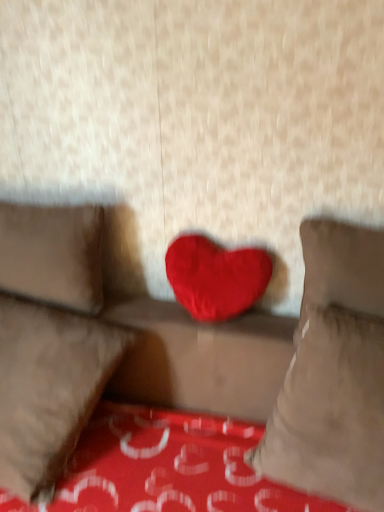
Where is `suede-like beige pillow at left, the first pillow in the left-to-right sequence`? Image resolution: width=384 pixels, height=512 pixels. suede-like beige pillow at left, the first pillow in the left-to-right sequence is located at coordinates (53, 254).

Who is bigger, velvet red heart at center or suede-like beige pillow at left, the first pillow in the left-to-right sequence?

velvet red heart at center is bigger.

Image resolution: width=384 pixels, height=512 pixels. I want to click on studio couch on the right of suede-like beige pillow at left, placed as the third pillow when sorted from right to left, so click(202, 360).

Who is more distant, velvet red heart at center or suede-like beige pillow at left, the first pillow in the left-to-right sequence?

suede-like beige pillow at left, the first pillow in the left-to-right sequence, is more distant.

Choose the correct answer: Is velvet red heart at center inside suede-like beige pillow at left, the first pillow in the left-to-right sequence, or outside it?

velvet red heart at center is not inside suede-like beige pillow at left, the first pillow in the left-to-right sequence, it's outside.

From a real-world perspective, is velvet red heart at center, positioned as the third pillow in left-to-right order, beneath red plush heart at center?

Yes.

Between point (253, 451) and point (210, 242), which one is positioned in front?

The point (253, 451) is closer.

Is velvet red heart at center, positioned as the third pillow in left-to-right order, at the left side of red plush heart at center?

No.

Is velvet red heart at center, positioned as the third pillow in left-to-right order, beside red plush heart at center?

No, velvet red heart at center, positioned as the third pillow in left-to-right order, is not with red plush heart at center.

Considering the sizes of objects velvet red heart at center, which is the 2th pillow from right to left, and velvet red heart at center, positioned as the third pillow in left-to-right order, in the image provided, who is thinner, velvet red heart at center, which is the 2th pillow from right to left, or velvet red heart at center, positioned as the third pillow in left-to-right order,?

With smaller width is velvet red heart at center, positioned as the third pillow in left-to-right order.

In the image, is velvet red heart at center, which is the 2th pillow from right to left, on the left side or the right side of velvet red heart at center, marked as the first pillow in a right-to-left arrangement?

velvet red heart at center, which is the 2th pillow from right to left, is positioned on velvet red heart at center, marked as the first pillow in a right-to-left arrangement,'s left side.

In the scene shown: Is velvet red heart at center, which is the 2th pillow from right to left, located outside velvet red heart at center, marked as the first pillow in a right-to-left arrangement?

That's correct, velvet red heart at center, which is the 2th pillow from right to left, is outside of velvet red heart at center, marked as the first pillow in a right-to-left arrangement.

Is velvet red heart at center, which is the 2th pillow from right to left, looking in the opposite direction of velvet red heart at center, positioned as the third pillow in left-to-right order?

No, velvet red heart at center, which is the 2th pillow from right to left,'s orientation is not away from velvet red heart at center, positioned as the third pillow in left-to-right order.

Is red plush heart at center directly adjacent to velvet red heart at center?

There is a gap between red plush heart at center and velvet red heart at center.

Is red plush heart at center looking in the opposite direction of velvet red heart at center?

That's not correct — red plush heart at center is not looking away from velvet red heart at center.

Considering the sizes of red plush heart at center and velvet red heart at center in the image, is red plush heart at center taller or shorter than velvet red heart at center?

In the image, red plush heart at center appears to be shorter than velvet red heart at center.

Considering the positions of objects red plush heart at center and velvet red heart at center in the image provided, who is behind, red plush heart at center or velvet red heart at center?

red plush heart at center is more distant.

The height and width of the screenshot is (512, 384). Find the location of `studio couch on the left of the velvet red heart at center, marked as the first pillow in a right-to-left arrangement`. studio couch on the left of the velvet red heart at center, marked as the first pillow in a right-to-left arrangement is located at coordinates (202, 360).

Is velvet red heart at center taller or shorter than velvet red heart at center, positioned as the third pillow in left-to-right order?

Clearly, velvet red heart at center is shorter compared to velvet red heart at center, positioned as the third pillow in left-to-right order.

Based on their positions, is velvet red heart at center located to the left or right of velvet red heart at center, positioned as the third pillow in left-to-right order?

Clearly, velvet red heart at center is on the left of velvet red heart at center, positioned as the third pillow in left-to-right order, in the image.

Is velvet red heart at center, which is the 2th pillow from left to right, completely or partially inside velvet red heart at center, positioned as the third pillow in left-to-right order?

Actually, velvet red heart at center, which is the 2th pillow from left to right, is outside velvet red heart at center, positioned as the third pillow in left-to-right order.

Considering the positions of points (313, 333) and (63, 324), is point (313, 333) closer to camera compared to point (63, 324)?

Yes, it is in front of point (63, 324).

Would you consider velvet red heart at center, marked as the first pillow in a right-to-left arrangement, to be distant from velvet red heart at center, which is the 2th pillow from right to left?

Actually, velvet red heart at center, marked as the first pillow in a right-to-left arrangement, and velvet red heart at center, which is the 2th pillow from right to left, are a little close together.

Is velvet red heart at center, positioned as the third pillow in left-to-right order, taller or shorter than velvet red heart at center, which is the 2th pillow from left to right?

velvet red heart at center, positioned as the third pillow in left-to-right order, is shorter than velvet red heart at center, which is the 2th pillow from left to right.

Would you consider red plush heart at center to be distant from velvet red heart at center, which is the 2th pillow from left to right?

No, red plush heart at center is not far away from velvet red heart at center, which is the 2th pillow from left to right.

Based on the photo, is red plush heart at center at the left side of velvet red heart at center, which is the 2th pillow from right to left?

No, red plush heart at center is not to the left of velvet red heart at center, which is the 2th pillow from right to left.

How different are the orientations of red plush heart at center and velvet red heart at center, which is the 2th pillow from right to left, in degrees?

2.86 degrees.

From a real-world perspective, between red plush heart at center and velvet red heart at center, which is the 2th pillow from right to left, who is vertically lower?

velvet red heart at center, which is the 2th pillow from right to left.

Find the location of a particular element. The image size is (384, 512). studio couch that appears on the right of suede-like beige pillow at left, the first pillow in the left-to-right sequence is located at coordinates (202, 360).

Locate an element on the screen. The height and width of the screenshot is (512, 384). heart located above the velvet red heart at center, marked as the first pillow in a right-to-left arrangement (from a real-world perspective) is located at coordinates (216, 277).

Which object lies nearer to the anchor point velvet red heart at center, positioned as the third pillow in left-to-right order, suede-like beige pillow at left, placed as the third pillow when sorted from right to left, or velvet red heart at center?

velvet red heart at center is closer to velvet red heart at center, positioned as the third pillow in left-to-right order.

Considering their positions, is velvet red heart at center, which is the 2th pillow from right to left, positioned closer to suede-like beige pillow at left, the first pillow in the left-to-right sequence, than red plush heart at center?

The object closer to suede-like beige pillow at left, the first pillow in the left-to-right sequence, is velvet red heart at center, which is the 2th pillow from right to left.

Looking at the image, which one is located further to red plush heart at center, suede-like beige pillow at left, the first pillow in the left-to-right sequence, or velvet red heart at center, marked as the first pillow in a right-to-left arrangement?

velvet red heart at center, marked as the first pillow in a right-to-left arrangement, is positioned further to the anchor red plush heart at center.

Looking at the image, which one is located further to velvet red heart at center, suede-like beige pillow at left, placed as the third pillow when sorted from right to left, or velvet red heart at center, marked as the first pillow in a right-to-left arrangement?

velvet red heart at center, marked as the first pillow in a right-to-left arrangement.

Considering their positions, is velvet red heart at center, which is the 2th pillow from right to left, positioned further to red plush heart at center than velvet red heart at center, positioned as the third pillow in left-to-right order?

Based on the image, velvet red heart at center, which is the 2th pillow from right to left, appears to be further to red plush heart at center.

Considering their positions, is velvet red heart at center, which is the 2th pillow from left to right, positioned further to velvet red heart at center than red plush heart at center?

Among the two, red plush heart at center is located further to velvet red heart at center.

Looking at this image, from the image, which object appears to be farther from velvet red heart at center, velvet red heart at center, marked as the first pillow in a right-to-left arrangement, or velvet red heart at center, which is the 2th pillow from left to right?

velvet red heart at center, marked as the first pillow in a right-to-left arrangement, is further to velvet red heart at center.

Based on their spatial positions, is suede-like beige pillow at left, placed as the third pillow when sorted from right to left, or red plush heart at center further from velvet red heart at center, marked as the first pillow in a right-to-left arrangement?

Based on the image, suede-like beige pillow at left, placed as the third pillow when sorted from right to left, appears to be further to velvet red heart at center, marked as the first pillow in a right-to-left arrangement.

Where is `pillow between suede-like beige pillow at left, the first pillow in the left-to-right sequence, and velvet red heart at center, marked as the first pillow in a right-to-left arrangement, in the horizontal direction`? pillow between suede-like beige pillow at left, the first pillow in the left-to-right sequence, and velvet red heart at center, marked as the first pillow in a right-to-left arrangement, in the horizontal direction is located at coordinates (48, 388).

Locate an element on the screen. The width and height of the screenshot is (384, 512). heart between velvet red heart at center, which is the 2th pillow from left to right, and velvet red heart at center, positioned as the third pillow in left-to-right order, from left to right is located at coordinates (216, 277).

This screenshot has height=512, width=384. What are the coordinates of `studio couch between suede-like beige pillow at left, the first pillow in the left-to-right sequence, and velvet red heart at center, marked as the first pillow in a right-to-left arrangement, in the horizontal direction` in the screenshot? It's located at (202, 360).

Identify the location of studio couch located between velvet red heart at center, which is the 2th pillow from left to right, and velvet red heart at center, marked as the first pillow in a right-to-left arrangement, in the left-right direction. The width and height of the screenshot is (384, 512). (202, 360).